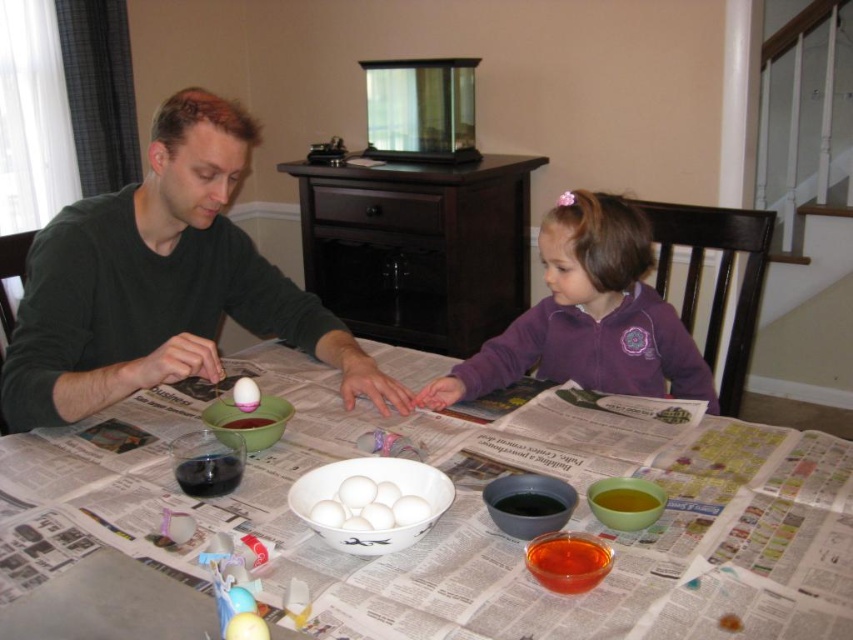
Question: Does matte black egg at left lie behind pink matte egg at center?

Choices:
 (A) no
 (B) yes

Answer: (A)

Question: Which point appears farthest from the camera in this image?

Choices:
 (A) (392, 481)
 (B) (567, 262)

Answer: (B)

Question: Can you confirm if white glossy bowl at center is smaller than pink matte egg at center?

Choices:
 (A) no
 (B) yes

Answer: (A)

Question: Where is purple fleece jacket at center located in relation to pink matte egg at center in the image?

Choices:
 (A) below
 (B) above

Answer: (B)

Question: Which point is farther to the camera?

Choices:
 (A) click(221, 108)
 (B) click(752, 512)
 (C) click(239, 406)
 (D) click(421, 502)

Answer: (A)

Question: Which object is the farthest from the pink matte egg at center?

Choices:
 (A) purple fleece jacket at center
 (B) white glossy eggs at center

Answer: (A)